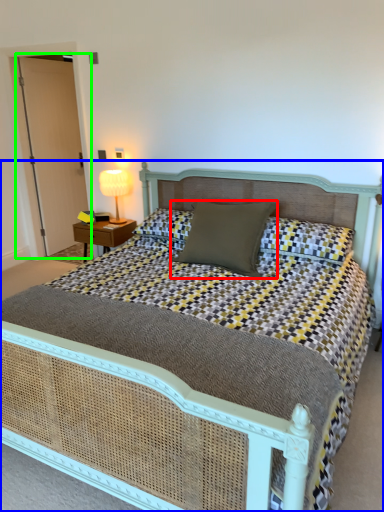
Question: Which is farther away from pillow (highlighted by a red box)? bed (highlighted by a blue box) or glass door (highlighted by a green box)?

Choices:
 (A) bed
 (B) glass door

Answer: (B)